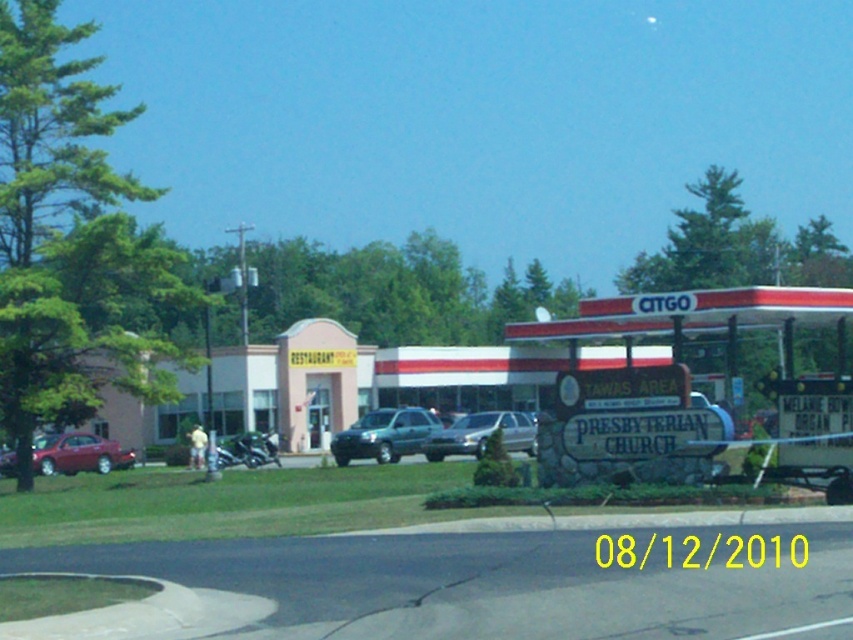
Question: Is shiny red sedan at left above metallic silver motorcycle at center?

Choices:
 (A) yes
 (B) no

Answer: (B)

Question: Based on their relative distances, which object is farther from the metallic silver motorcycle at center?

Choices:
 (A) satin silver sedan at center
 (B) green matte suv at center
 (C) shiny red sedan at left
 (D) stone signboard at center

Answer: (D)

Question: Which object appears closest to the camera in this image?

Choices:
 (A) shiny red sedan at left
 (B) metallic silver motorcycle at center

Answer: (B)

Question: Among these points, which one is nearest to the camera?

Choices:
 (A) (492, 426)
 (B) (231, 464)
 (C) (10, 460)
 (D) (370, 458)

Answer: (B)

Question: Does shiny red sedan at left appear on the left side of satin silver sedan at center?

Choices:
 (A) no
 (B) yes

Answer: (B)

Question: Is satin silver sedan at center above metallic silver motorcycle at center?

Choices:
 (A) yes
 (B) no

Answer: (A)